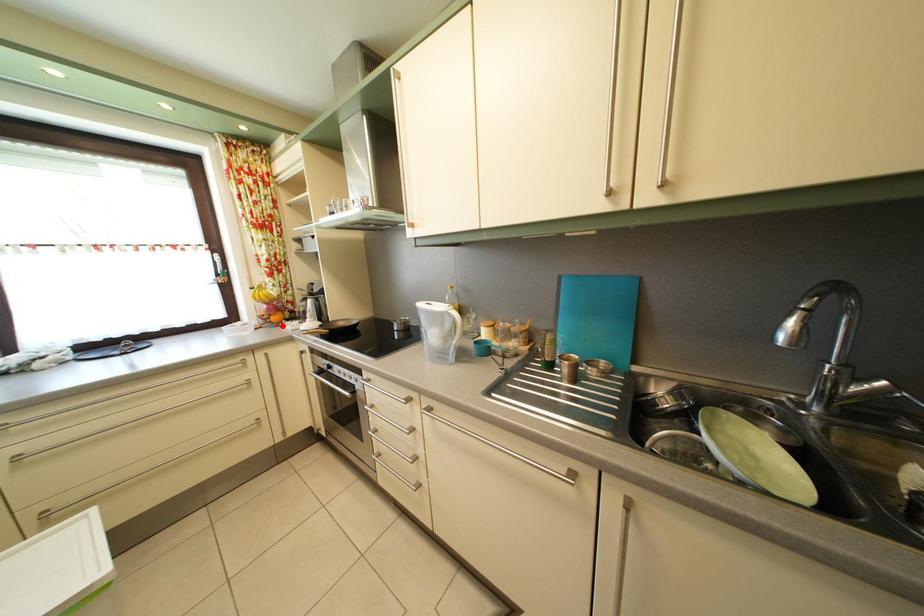
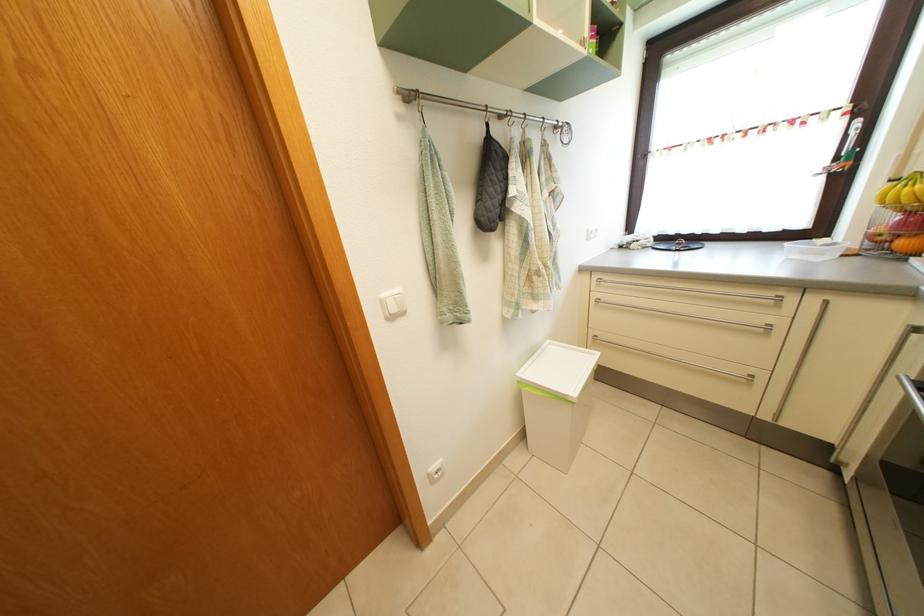
Question: I am providing you with two images of the same scene from different viewpoints. Given a red point in image1, look at the same physical point in image2. Is it:

Choices:
 (A) Closer to the viewpoint
 (B) Farther from the viewpoint

Answer: (B)